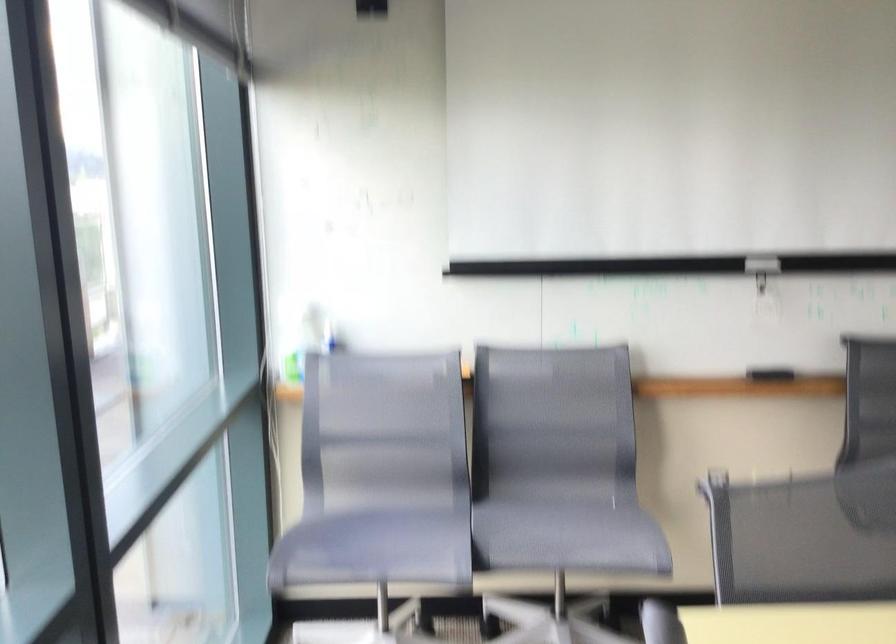
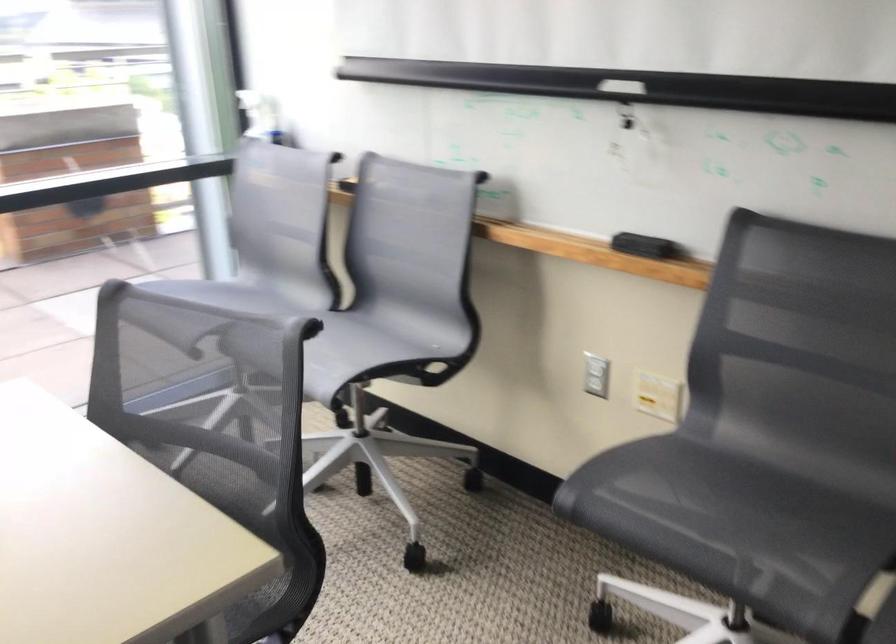
Find the pixel in the second image that matches the point at 588,525 in the first image.

(348, 351)